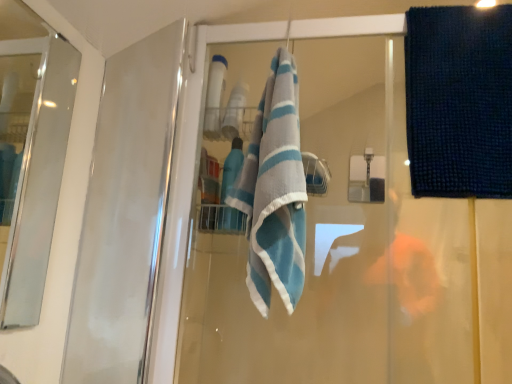
Question: Considering the relative sizes of dark blue textured towel at upper right and blue striped towel at center in the image provided, is dark blue textured towel at upper right thinner than blue striped towel at center?

Choices:
 (A) no
 (B) yes

Answer: (B)

Question: From a real-world perspective, is dark blue textured towel at upper right below blue striped towel at center?

Choices:
 (A) no
 (B) yes

Answer: (A)

Question: Considering the relative sizes of dark blue textured towel at upper right and blue striped towel at center in the image provided, is dark blue textured towel at upper right wider than blue striped towel at center?

Choices:
 (A) yes
 (B) no

Answer: (B)

Question: Is the position of dark blue textured towel at upper right more distant than that of blue striped towel at center?

Choices:
 (A) no
 (B) yes

Answer: (B)

Question: Is dark blue textured towel at upper right directly adjacent to blue striped towel at center?

Choices:
 (A) yes
 (B) no

Answer: (B)

Question: Considering the positions of point (61, 162) and point (439, 99), is point (61, 162) closer or farther from the camera than point (439, 99)?

Choices:
 (A) farther
 (B) closer

Answer: (A)

Question: Considering their positions, is clear glass screen door at left located in front of or behind dark blue textured towel at upper right?

Choices:
 (A) front
 (B) behind

Answer: (A)

Question: In terms of height, does clear glass screen door at left look taller or shorter compared to dark blue textured towel at upper right?

Choices:
 (A) short
 (B) tall

Answer: (B)

Question: Considering the positions of clear glass screen door at left and dark blue textured towel at upper right in the image, is clear glass screen door at left bigger or smaller than dark blue textured towel at upper right?

Choices:
 (A) big
 (B) small

Answer: (B)

Question: Is point (22, 281) closer or farther from the camera than point (267, 198)?

Choices:
 (A) closer
 (B) farther

Answer: (B)

Question: Is clear glass screen door at left in front of or behind blue striped towel at center in the image?

Choices:
 (A) behind
 (B) front

Answer: (B)

Question: In the image, is clear glass screen door at left on the left side or the right side of blue striped towel at center?

Choices:
 (A) right
 (B) left

Answer: (B)

Question: Is clear glass screen door at left spatially inside blue striped towel at center, or outside of it?

Choices:
 (A) outside
 (B) inside

Answer: (A)

Question: Is point (302, 221) positioned closer to the camera than point (40, 145)?

Choices:
 (A) closer
 (B) farther

Answer: (A)

Question: In the image, is blue striped towel at center positioned in front of or behind clear glass screen door at left?

Choices:
 (A) front
 (B) behind

Answer: (B)